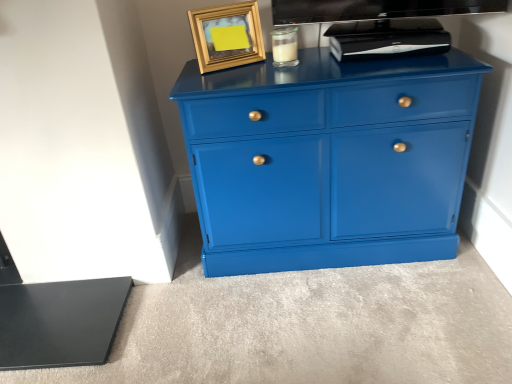
The height and width of the screenshot is (384, 512). What are the coordinates of `free location in front of gold metallic picture frame at upper center` in the screenshot? It's located at (214, 77).